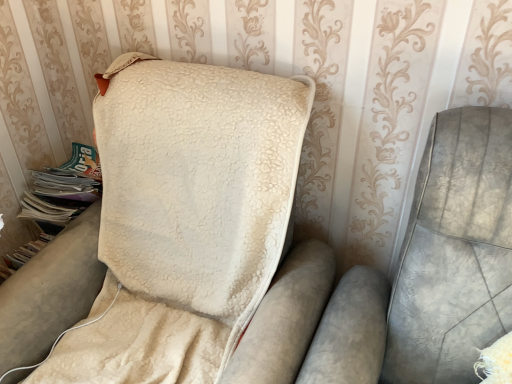
Question: Considering the positions of green paper magazine at left and beige fleece blanket at center in the image, is green paper magazine at left wider or thinner than beige fleece blanket at center?

Choices:
 (A) wide
 (B) thin

Answer: (B)

Question: From the image's perspective, is green paper magazine at left located above or below beige fleece blanket at center?

Choices:
 (A) above
 (B) below

Answer: (A)

Question: In terms of height, does green paper magazine at left look taller or shorter compared to beige fleece blanket at center?

Choices:
 (A) tall
 (B) short

Answer: (B)

Question: Is beige fleece blanket at center in front of or behind green paper magazine at left in the image?

Choices:
 (A) behind
 (B) front

Answer: (B)

Question: Looking at their shapes, would you say beige fleece blanket at center is wider or thinner than green paper magazine at left?

Choices:
 (A) wide
 (B) thin

Answer: (A)

Question: Does point (151, 317) appear closer or farther from the camera than point (75, 193)?

Choices:
 (A) farther
 (B) closer

Answer: (B)

Question: From a real-world perspective, is beige fleece blanket at center physically located above or below green paper magazine at left?

Choices:
 (A) above
 (B) below

Answer: (B)